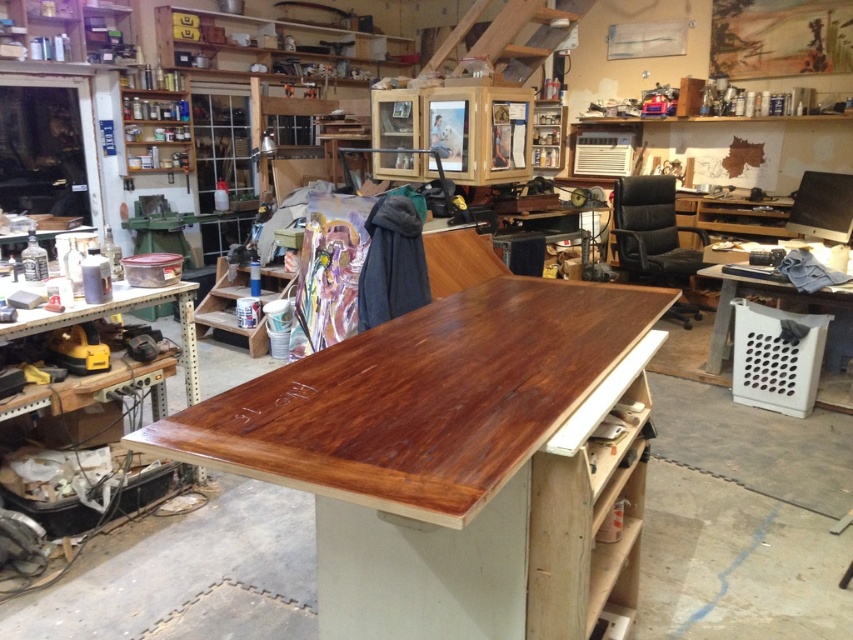
You are organizing a space in the workshop and need to place a large equipment that requires a bigger surface. Which object between the shiny wood table at center and the wooden workbench at left should you choose?

The shiny wood table at center is larger in size than the wooden workbench at left, so you should choose the shiny wood table at center for placing the large equipment.

You are organizing a space in the workshop and need to place a large equipment that requires a wider surface. Which object between the shiny wood table at center and the wooden workbench at left would be more suitable for placing the equipment?

The shiny wood table at center has a larger width than the wooden workbench at left, so it would be more suitable for placing the large equipment that requires a wider surface.